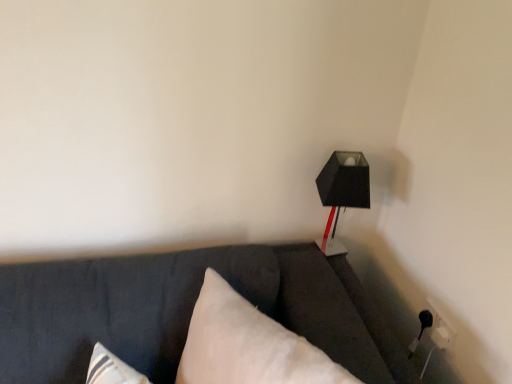
Question: From the image's perspective, is black matte lamp at upper right positioned above or below white soft pillow at center?

Choices:
 (A) above
 (B) below

Answer: (A)

Question: From a real-world perspective, relative to white soft pillow at center, is black matte lamp at upper right vertically above or below?

Choices:
 (A) below
 (B) above

Answer: (B)

Question: Is black matte lamp at upper right bigger or smaller than white soft pillow at center?

Choices:
 (A) small
 (B) big

Answer: (A)

Question: From the image's perspective, is white soft pillow at center above or below black matte lamp at upper right?

Choices:
 (A) below
 (B) above

Answer: (A)

Question: From a real-world perspective, is white soft pillow at center physically located above or below black matte lamp at upper right?

Choices:
 (A) below
 (B) above

Answer: (A)

Question: Based on their sizes in the image, would you say white soft pillow at center is bigger or smaller than black matte lamp at upper right?

Choices:
 (A) small
 (B) big

Answer: (B)

Question: Considering the positions of white soft pillow at center and black matte lamp at upper right in the image, is white soft pillow at center taller or shorter than black matte lamp at upper right?

Choices:
 (A) tall
 (B) short

Answer: (A)